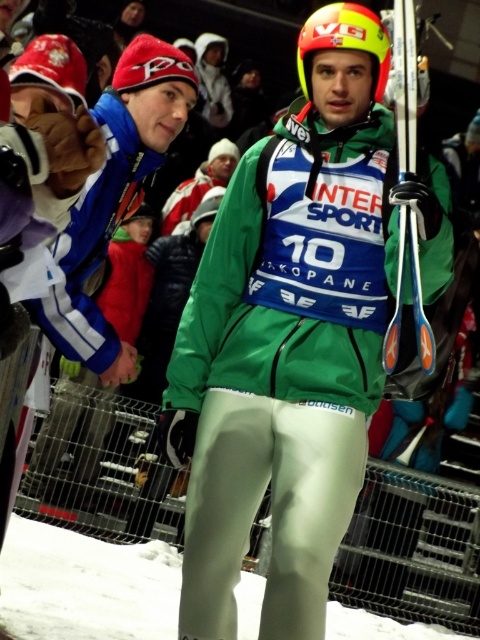
Between point (39, 545) and point (323, 45), which one is positioned behind?

Positioned behind is point (39, 545).

Can you confirm if white matte snow at lower center is thinner than yellow matte helmet at center?

Incorrect, white matte snow at lower center's width is not less than yellow matte helmet at center's.

Which is behind, point (337, 627) or point (375, 29)?

Positioned behind is point (337, 627).

Locate an element on the screen. white matte snow at lower center is located at coordinates (85, 586).

Does shiny metallic ski at center have a lesser width compared to yellow matte helmet at center?

Indeed, shiny metallic ski at center has a lesser width compared to yellow matte helmet at center.

Is point (392, 336) behind point (368, 33)?

No, (392, 336) is in front of (368, 33).

Find the location of a particular element. shiny metallic ski at center is located at coordinates (411, 292).

Is green matte jacket at center below red knit cap at upper left?

Yes.

Does point (322, 557) lie behind point (71, 68)?

Yes, it is.

Where is `green matte jacket at center`? Image resolution: width=480 pixels, height=640 pixels. green matte jacket at center is located at coordinates coord(288,339).